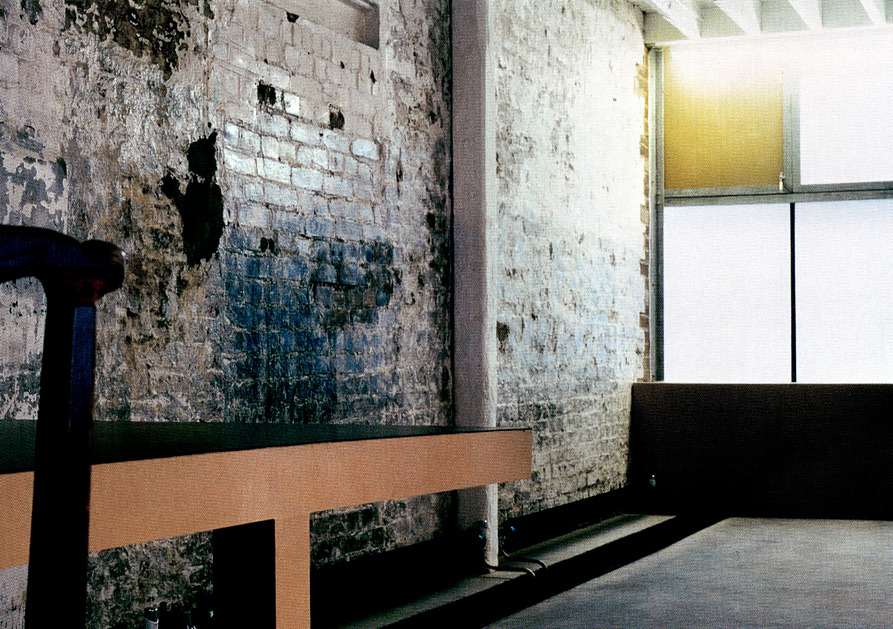
Image resolution: width=893 pixels, height=629 pixels. I want to click on floor, so click(772, 584).